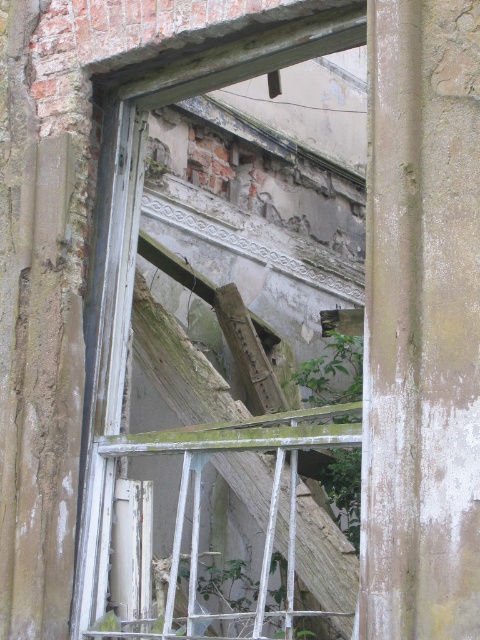
Question: Which point is farther to the camera?

Choices:
 (A) green leafy plant at center
 (B) white painted wood window frame at center

Answer: (B)

Question: Can you confirm if white painted wood window frame at center is smaller than green leafy plant at center?

Choices:
 (A) no
 (B) yes

Answer: (B)

Question: Which point is closer to the camera?

Choices:
 (A) green leafy plant at center
 (B) white painted wood window frame at center

Answer: (A)

Question: Can you confirm if white painted wood window frame at center is positioned to the left of green leafy plant at center?

Choices:
 (A) no
 (B) yes

Answer: (B)

Question: Can you confirm if white painted wood window frame at center is positioned above green leafy plant at center?

Choices:
 (A) yes
 (B) no

Answer: (A)